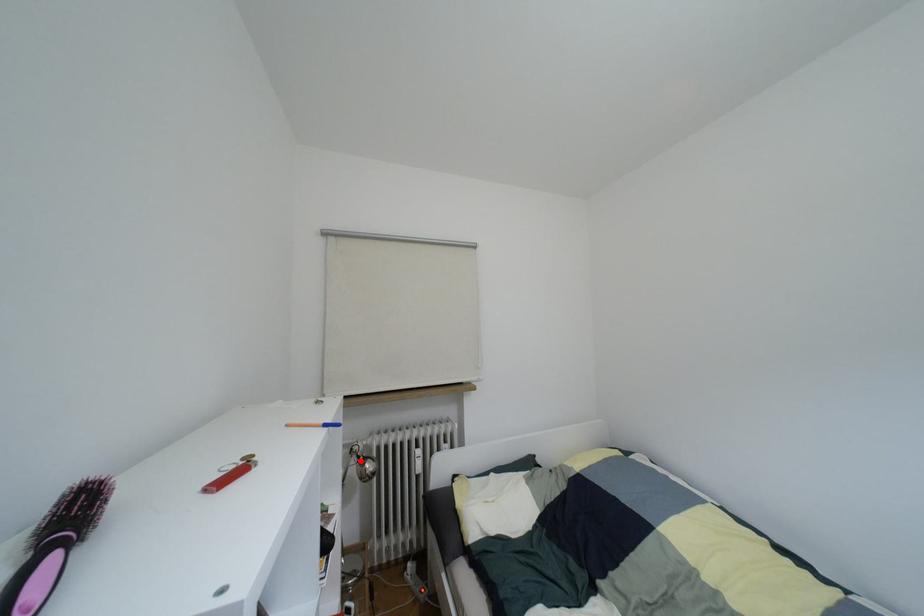
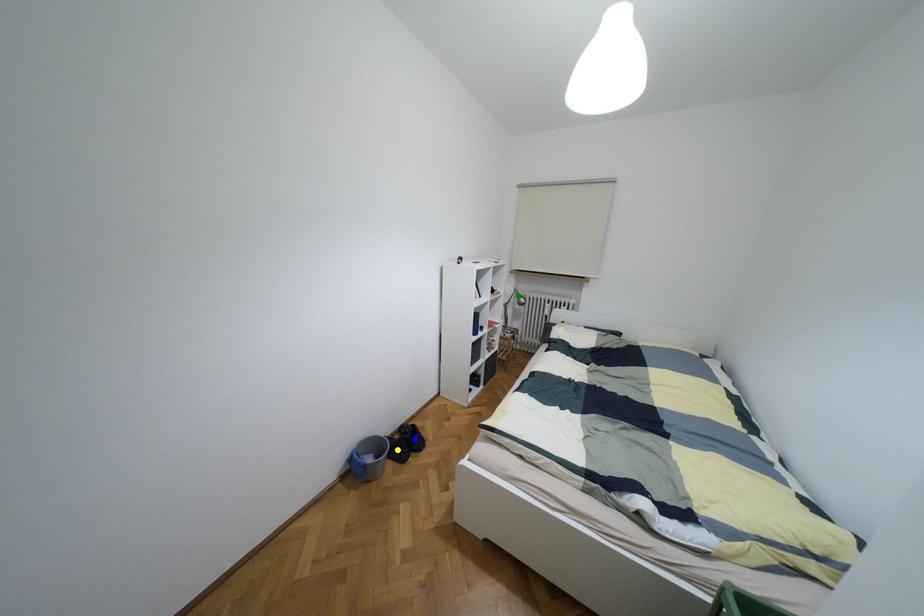
Question: I am providing you with two images of the same scene from different viewpoints. A red point is marked on the first image. You are given multiple points on the second image. In image 2, which mark is for the same physical point as the one in image 1?

Choices:
 (A) yellow point
 (B) green point
 (C) blue point

Answer: (B)